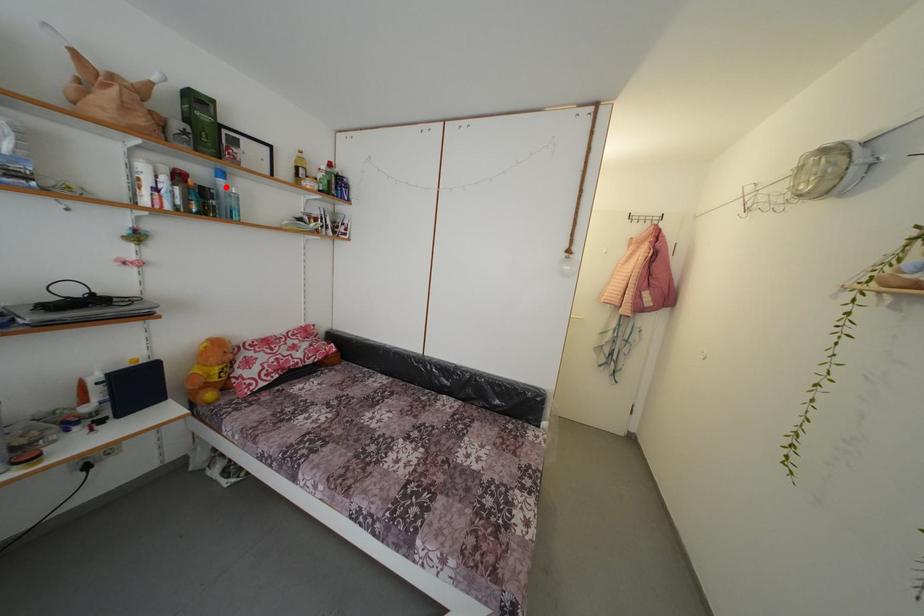
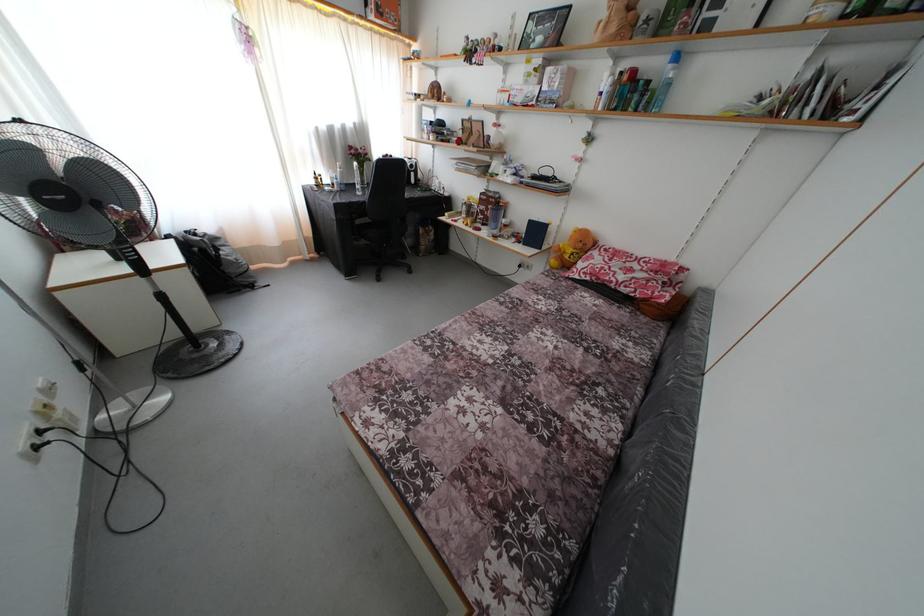
Locate, in the second image, the point that corresponds to the highlighted location in the first image.

(675, 73)